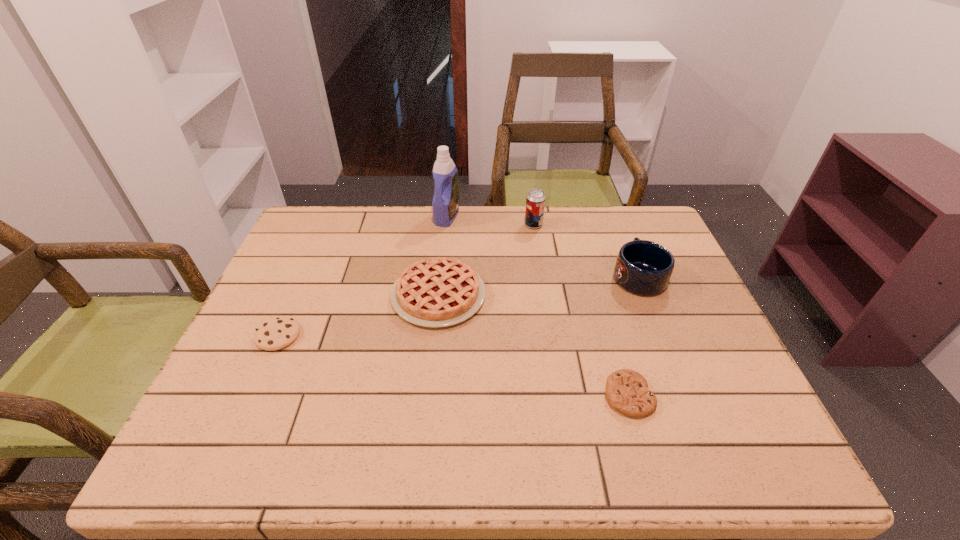
This screenshot has height=540, width=960. I want to click on free space located 0.130m on the left of the beer can, so click(x=483, y=225).

Identify the location of free region located with the handle on the side of the fourth shortest object. The image size is (960, 540). (623, 237).

I want to click on free region located 0.130m with the handle on the side of the fourth shortest object, so click(x=620, y=230).

Where is `free space located with the handle on the side of the fourth shortest object`? free space located with the handle on the side of the fourth shortest object is located at coordinates (620, 232).

I want to click on vacant position located on the back of the pie, so click(446, 218).

You are a GUI agent. You are given a task and a screenshot of the screen. Output one action in this format:
    pyautogui.click(x=<x>, y=<y>)
    Task: Click on the vacant space situated 0.360m on the back of the left cookie
    
    Given the screenshot: What is the action you would take?
    pyautogui.click(x=324, y=233)

What are the coordinates of `vacant space located 0.070m on the back of the nearest object` in the screenshot? It's located at (615, 348).

The height and width of the screenshot is (540, 960). In order to click on detergent that is at the far edge in this screenshot , I will do `click(445, 203)`.

Locate an element on the screen. The width and height of the screenshot is (960, 540). beer can that is at the far edge is located at coordinates (535, 202).

Image resolution: width=960 pixels, height=540 pixels. What are the coordinates of `object located at the left edge` in the screenshot? It's located at (276, 333).